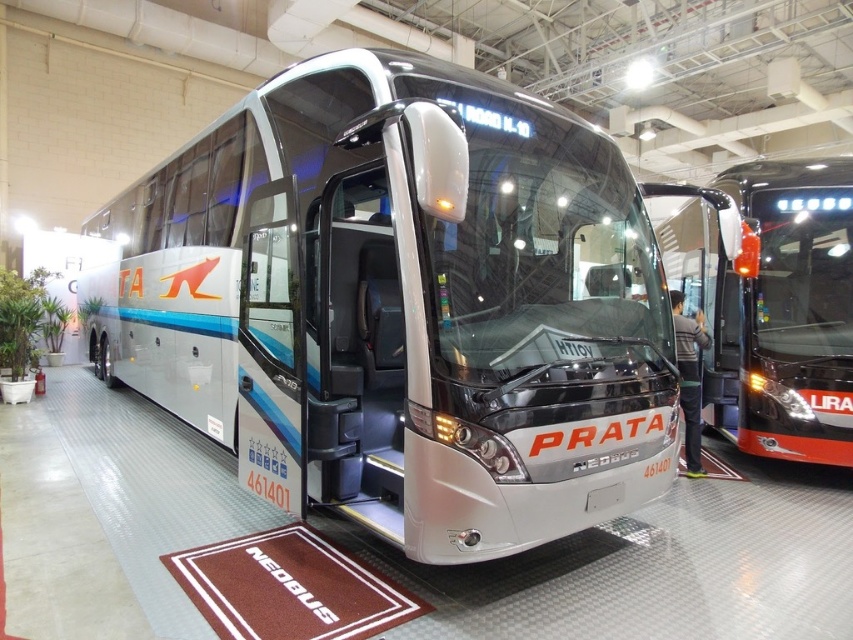
Can you confirm if shiny black bus at right is taller than sleek silver coach at center?

Yes, shiny black bus at right is taller than sleek silver coach at center.

Is shiny black bus at right to the right of sleek silver coach at center from the viewer's perspective?

Yes, shiny black bus at right is to the right of sleek silver coach at center.

What do you see at coordinates (770, 304) in the screenshot? The height and width of the screenshot is (640, 853). I see `shiny black bus at right` at bounding box center [770, 304].

This screenshot has height=640, width=853. I want to click on shiny black bus at right, so click(770, 304).

Is point (276, 294) positioned behind point (738, 358)?

No, it is in front of (738, 358).

How far apart are sleek silver bus at center and shiny black bus at right?

They are 4.41 meters apart.

Between point (509, 138) and point (798, 307), which one is positioned in front?

Positioned in front is point (509, 138).

Locate an element on the screen. sleek silver bus at center is located at coordinates (402, 305).

Which is more to the left, sleek silver bus at center or sleek silver coach at center?

From the viewer's perspective, sleek silver bus at center appears more on the left side.

Who is taller, sleek silver bus at center or sleek silver coach at center?

Standing taller between the two is sleek silver coach at center.

Where is `sleek silver bus at center`? sleek silver bus at center is located at coordinates (402, 305).